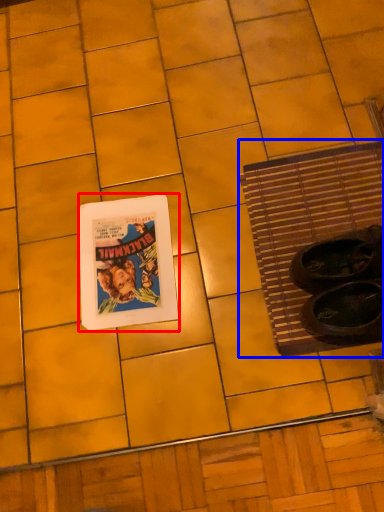
Question: Which object appears farthest to the camera in this image, picture frame (highlighted by a red box) or bath mat (highlighted by a blue box)?

Choices:
 (A) picture frame
 (B) bath mat

Answer: (A)